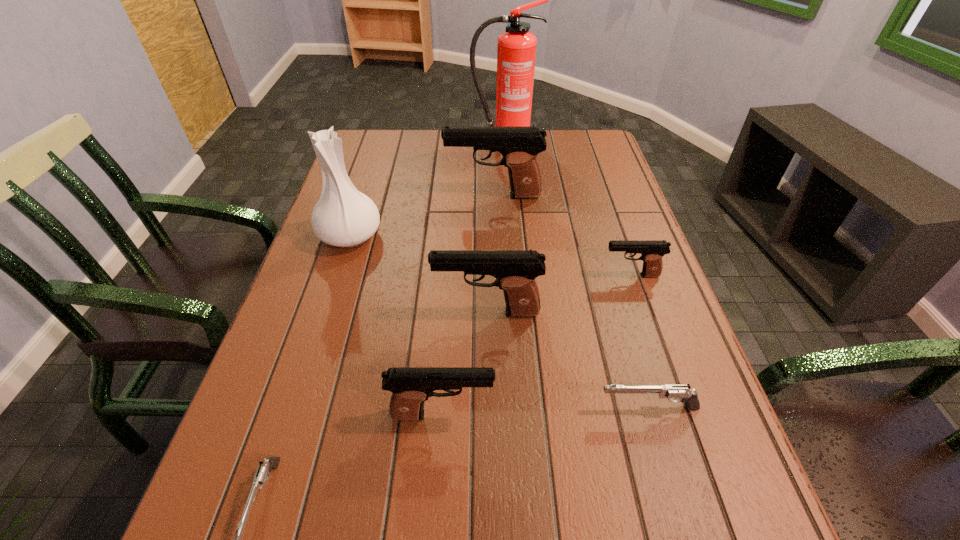
This screenshot has width=960, height=540. In order to click on free space located at the barrel of the third smallest black pistol in this screenshot , I will do click(359, 312).

Where is `blank space located 0.100m at the barrel of the third smallest black pistol`? blank space located 0.100m at the barrel of the third smallest black pistol is located at coordinates (388, 312).

This screenshot has height=540, width=960. In order to click on vacant region located at the barrel of the fourth shortest pistol in this screenshot , I will do `click(669, 415)`.

Where is `free spot located at the barrel of the smallest black pistol`? This screenshot has height=540, width=960. free spot located at the barrel of the smallest black pistol is located at coordinates (464, 275).

Where is `free point located 0.070m at the barrel of the smallest black pistol`? The width and height of the screenshot is (960, 540). free point located 0.070m at the barrel of the smallest black pistol is located at coordinates (571, 275).

At what (x,y) coordinates should I click in order to perform the action: click on vacant space situated at the barrel of the smallest black pistol. Please return your answer as a coordinate pair (x, y). Looking at the image, I should click on (464, 275).

Where is `free point located on the front-facing side of the right silver pistol`? The height and width of the screenshot is (540, 960). free point located on the front-facing side of the right silver pistol is located at coordinates (541, 408).

Identify the location of vacant space located 0.150m on the front-facing side of the right silver pistol. 514,408.

This screenshot has height=540, width=960. What are the coordinates of `vacant space located on the front-facing side of the right silver pistol` in the screenshot? It's located at (541, 408).

I want to click on object at the far edge, so click(x=516, y=52).